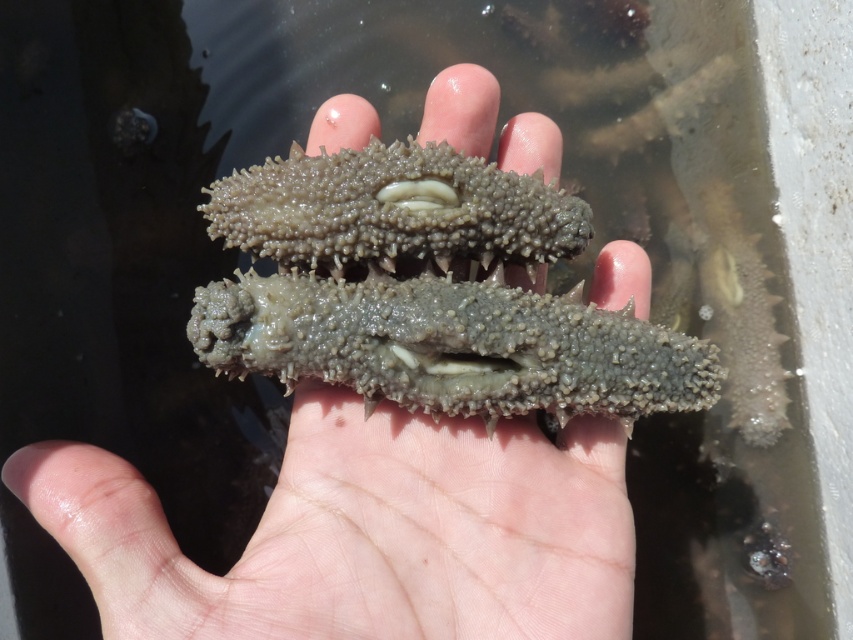
Can you confirm if gray matte sea cucumber at center is smaller than gray rough sea cucumber at center?

Incorrect, gray matte sea cucumber at center is not smaller in size than gray rough sea cucumber at center.

At what (x,y) coordinates should I click in order to perform the action: click on gray matte sea cucumber at center. Please return your answer as a coordinate pair (x, y). The image size is (853, 640). Looking at the image, I should click on (364, 531).

Where is `gray matte sea cucumber at center`? gray matte sea cucumber at center is located at coordinates (364, 531).